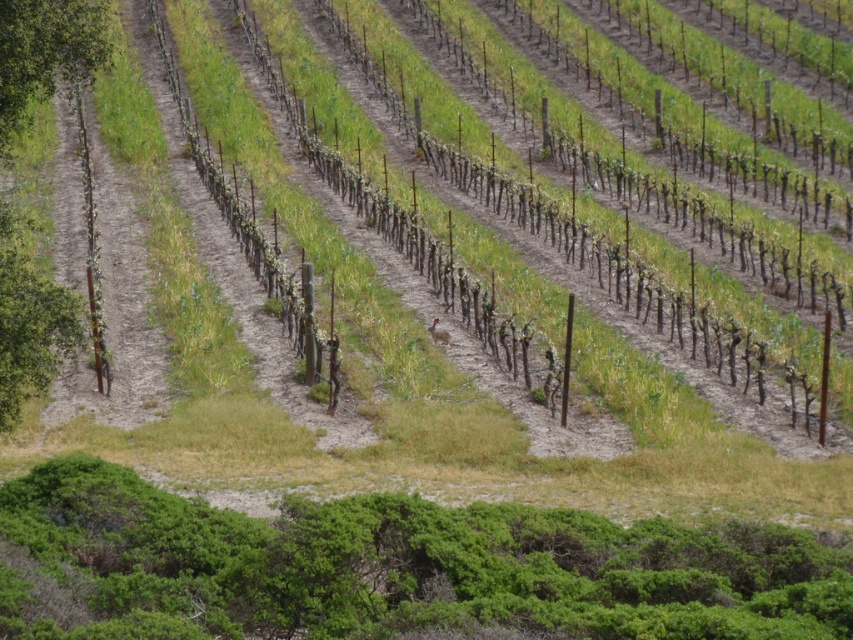
I want to click on smooth brown tree trunk at left, so click(28, 321).

Measure the distance between smooth brown tree trunk at left and camera.

The distance of smooth brown tree trunk at left from camera is 14.28 meters.

Which is in front, point (45, 337) or point (16, 116)?

Point (45, 337) is more forward.

Image resolution: width=853 pixels, height=640 pixels. I want to click on smooth brown tree trunk at left, so click(28, 321).